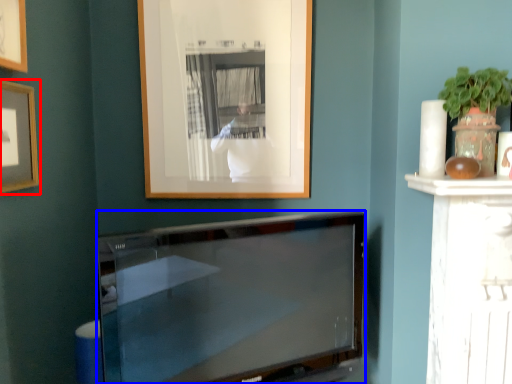
Question: Among these objects, which one is farthest to the camera, picture frame (highlighted by a red box) or television (highlighted by a blue box)?

Choices:
 (A) picture frame
 (B) television

Answer: (B)